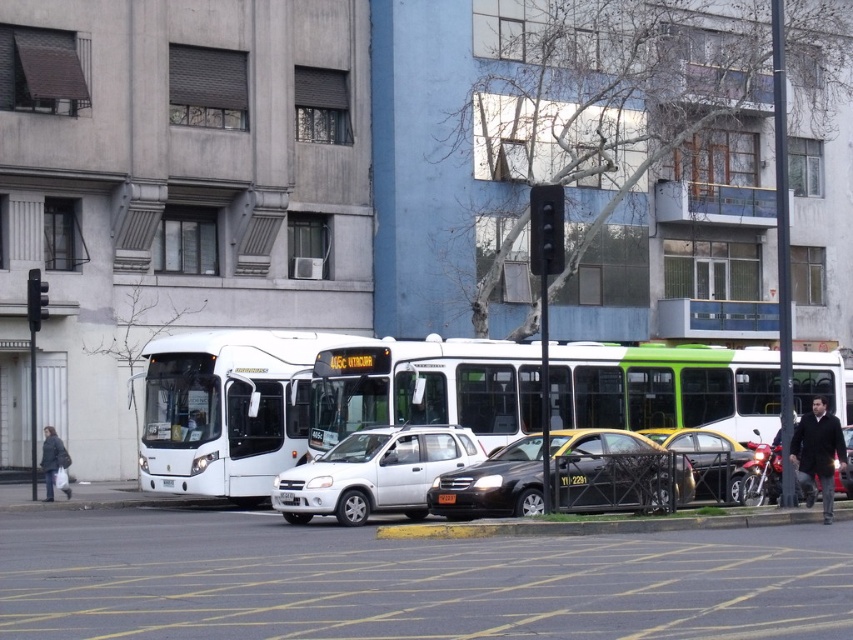
Is white matte car at center to the left of black asphalt curb at lower center from the viewer's perspective?

Indeed, white matte car at center is positioned on the left side of black asphalt curb at lower center.

Is white matte car at center thinner than black asphalt curb at lower center?

Incorrect, white matte car at center's width is not less than black asphalt curb at lower center's.

Is point (390, 486) positioned behind point (712, 513)?

Yes, it is.

Locate an element on the screen. white matte car at center is located at coordinates (373, 474).

Who is more forward, (640,440) or (740,497)?

Point (740,497) is more forward.

Based on the photo, between black matte taxi at center and shiny black sedan at center, which one appears on the right side from the viewer's perspective?

Positioned to the right is shiny black sedan at center.

This screenshot has height=640, width=853. Describe the element at coordinates (605, 468) in the screenshot. I see `black matte taxi at center` at that location.

The image size is (853, 640). What are the coordinates of `black matte taxi at center` in the screenshot? It's located at (605, 468).

Is white matte bus at center smaller than metallic silver car at right?

No, white matte bus at center is not smaller than metallic silver car at right.

Which is more to the right, white matte bus at center or metallic silver car at right?

metallic silver car at right is more to the right.

Locate an element on the screen. The height and width of the screenshot is (640, 853). white matte bus at center is located at coordinates (315, 400).